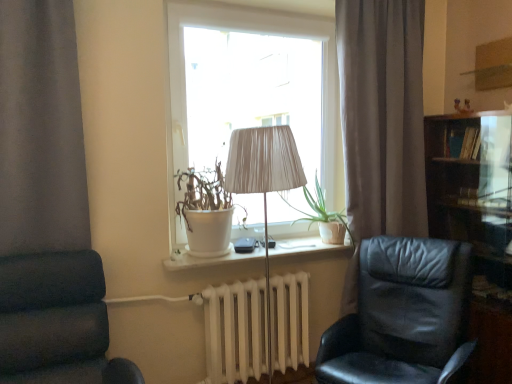
Question: From the image's perspective, is dark wood bookshelf at right on top of green matte plant at center?

Choices:
 (A) yes
 (B) no

Answer: (B)

Question: Does dark wood bookshelf at right have a smaller size compared to green matte plant at center?

Choices:
 (A) no
 (B) yes

Answer: (A)

Question: From the image's perspective, does dark wood bookshelf at right appear lower than green matte plant at center?

Choices:
 (A) no
 (B) yes

Answer: (B)

Question: Is dark wood bookshelf at right oriented towards green matte plant at center?

Choices:
 (A) no
 (B) yes

Answer: (B)

Question: Considering the relative sizes of dark wood bookshelf at right and green matte plant at center in the image provided, is dark wood bookshelf at right thinner than green matte plant at center?

Choices:
 (A) no
 (B) yes

Answer: (B)

Question: Is white matte pot at window wider or thinner than green matte plant at center?

Choices:
 (A) thin
 (B) wide

Answer: (A)

Question: From a real-world perspective, is white matte pot at window positioned above or below green matte plant at center?

Choices:
 (A) above
 (B) below

Answer: (A)

Question: Considering the positions of point (218, 241) and point (329, 226), is point (218, 241) closer or farther from the camera than point (329, 226)?

Choices:
 (A) farther
 (B) closer

Answer: (B)

Question: Looking at the image, does white matte pot at window seem bigger or smaller compared to green matte plant at center?

Choices:
 (A) big
 (B) small

Answer: (A)

Question: In the image, is white matte pot at window on the left side or the right side of dark blue fabric chair at left, which is the 2th chair in right-to-left order?

Choices:
 (A) right
 (B) left

Answer: (A)

Question: From a real-world perspective, is white matte pot at window positioned above or below dark blue fabric chair at left, which is the 2th chair in right-to-left order?

Choices:
 (A) above
 (B) below

Answer: (A)

Question: Is white matte pot at window wider or thinner than dark blue fabric chair at left, which is the 2th chair in right-to-left order?

Choices:
 (A) thin
 (B) wide

Answer: (A)

Question: Is white matte pot at window in front of or behind dark blue fabric chair at left, which is the 1th chair in left-to-right order, in the image?

Choices:
 (A) behind
 (B) front

Answer: (A)

Question: In terms of size, does white matte pot at window appear bigger or smaller than white ceramic window sill at center?

Choices:
 (A) big
 (B) small

Answer: (A)

Question: Is point (202, 208) closer or farther from the camera than point (331, 244)?

Choices:
 (A) farther
 (B) closer

Answer: (B)